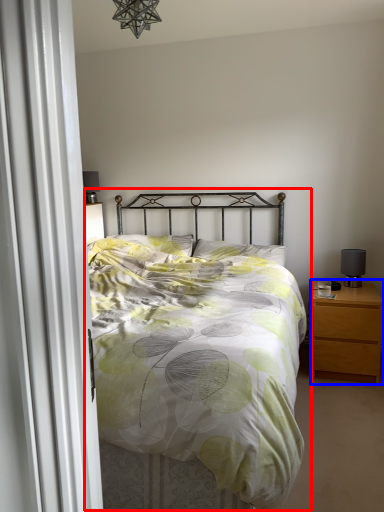
Question: Which object appears farthest to the camera in this image, bed (highlighted by a red box) or nightstand (highlighted by a blue box)?

Choices:
 (A) bed
 (B) nightstand

Answer: (B)